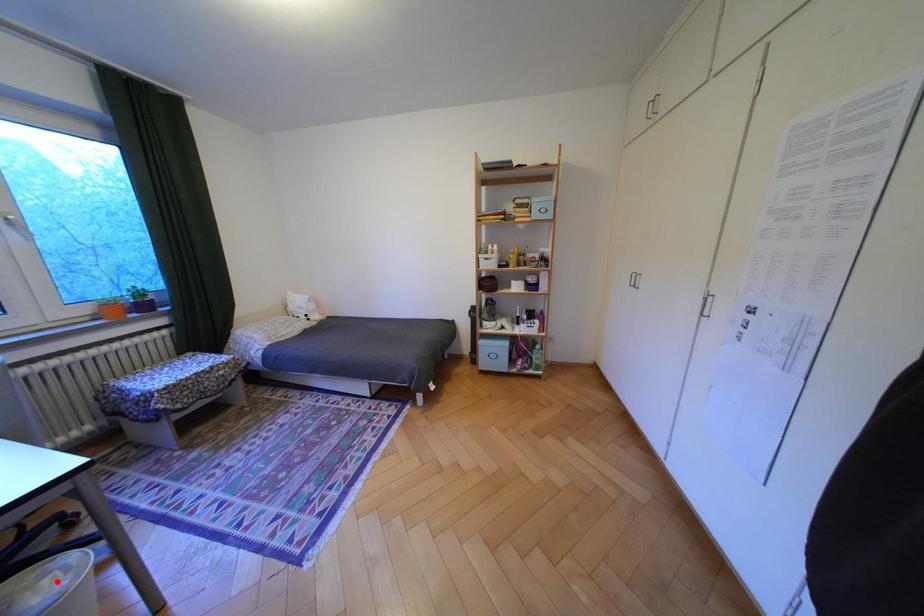
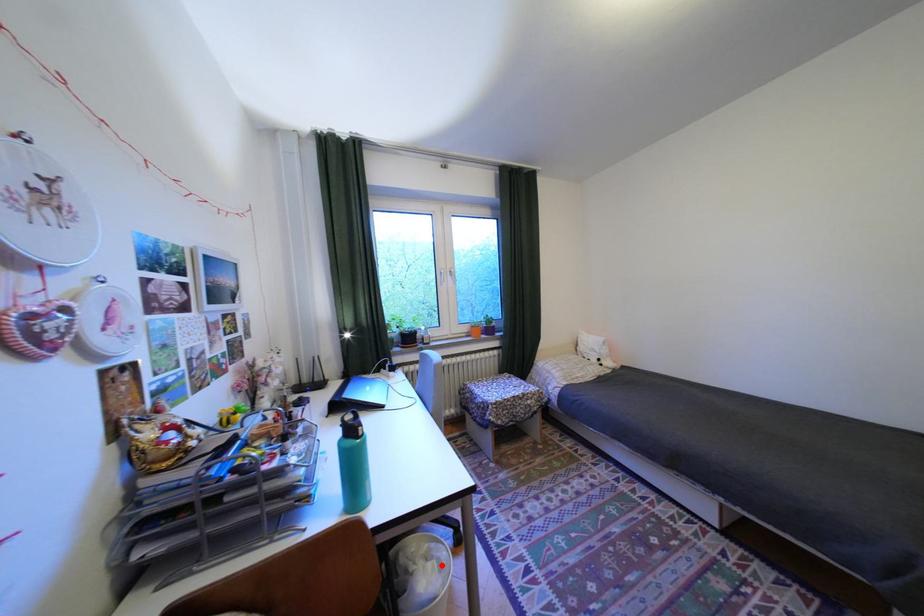
I am providing you with two images of the same scene from different viewpoints. A red point is marked on the first image and another point is marked on the second image. Does the point marked in image1 correspond to the same location as the one in image2?

Yes